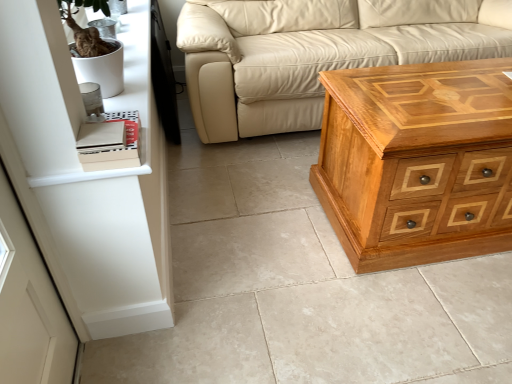
Question: Considering the positions of point (184, 46) and point (30, 124), is point (184, 46) closer or farther from the camera than point (30, 124)?

Choices:
 (A) closer
 (B) farther

Answer: (B)

Question: Looking at their shapes, would you say beige leather couch at center is wider or thinner than white matte shelf at upper left?

Choices:
 (A) thin
 (B) wide

Answer: (B)

Question: Which object is positioned farthest from the polished wood chest of drawers at right?

Choices:
 (A) white matte shelf at upper left
 (B) beige leather couch at center

Answer: (A)

Question: Based on their relative distances, which object is nearer to the beige leather couch at center?

Choices:
 (A) white matte shelf at upper left
 (B) polished wood chest of drawers at right

Answer: (B)